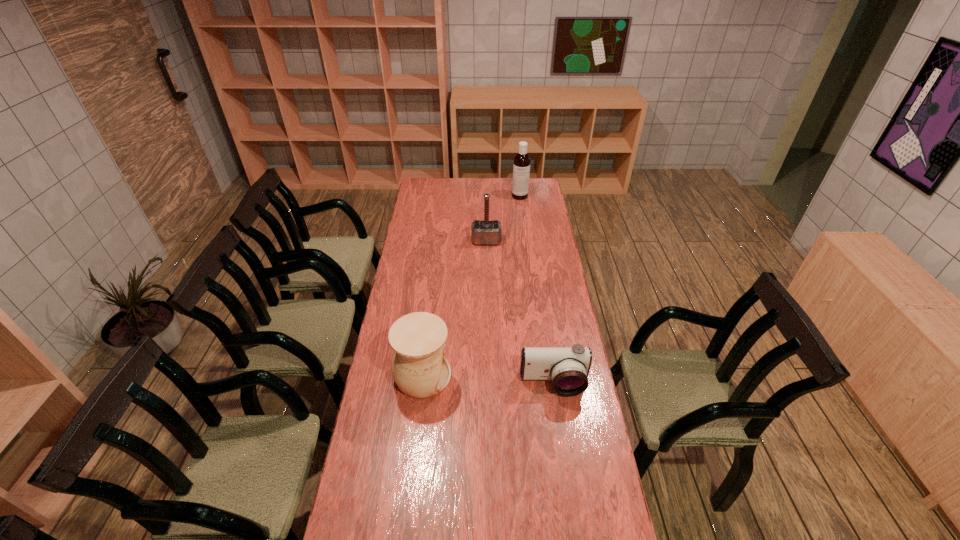
Image resolution: width=960 pixels, height=540 pixels. What are the coordinates of `vacant region between the leftmost object and the camcorder` in the screenshot? It's located at (488, 380).

This screenshot has width=960, height=540. Find the location of `free space that is in between the camcorder and the third object from right to left`. free space that is in between the camcorder and the third object from right to left is located at coordinates (520, 312).

Locate an element on the screen. Image resolution: width=960 pixels, height=540 pixels. free space between the second farthest object and the third tallest object is located at coordinates (454, 308).

This screenshot has height=540, width=960. What are the coordinates of `the third closest object to the farthest object` in the screenshot? It's located at (568, 367).

The image size is (960, 540). In order to click on the third closest object to the shortest object in this screenshot , I will do `click(521, 168)`.

This screenshot has height=540, width=960. In order to click on free location that satisfies the following two spatial constraints: 1. on the label side of the tallest object; 2. at the open side of the pottery in this screenshot , I will do `click(543, 376)`.